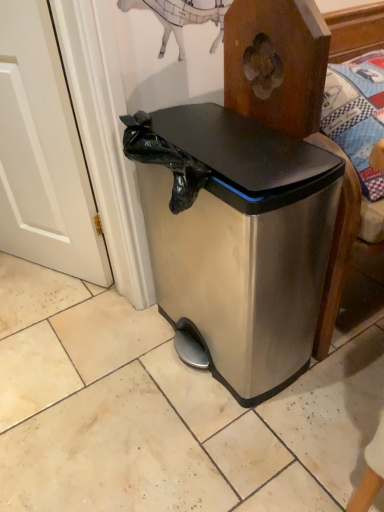
Where is `vacant area that lies to the right of stainless steel trash can at center`? Image resolution: width=384 pixels, height=512 pixels. vacant area that lies to the right of stainless steel trash can at center is located at coordinates (344, 360).